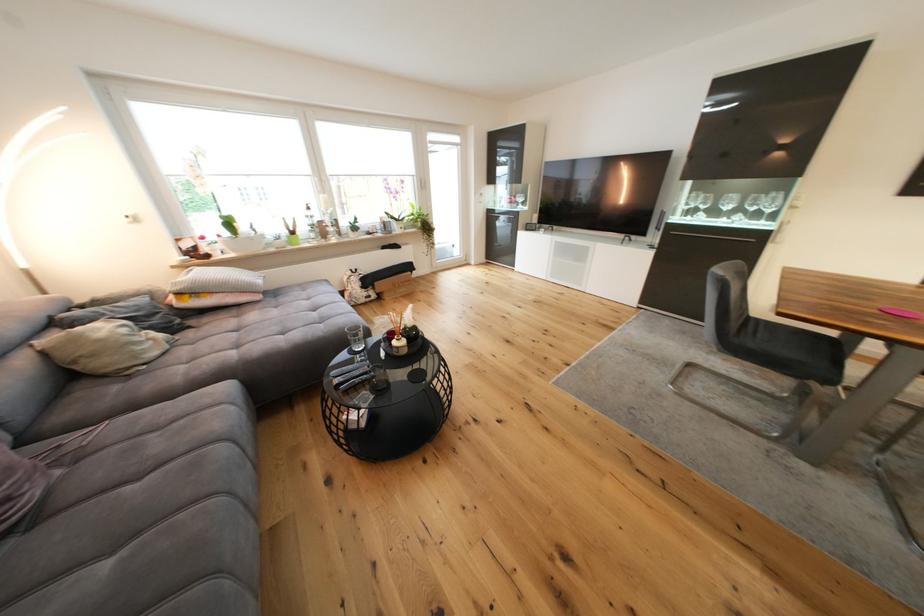
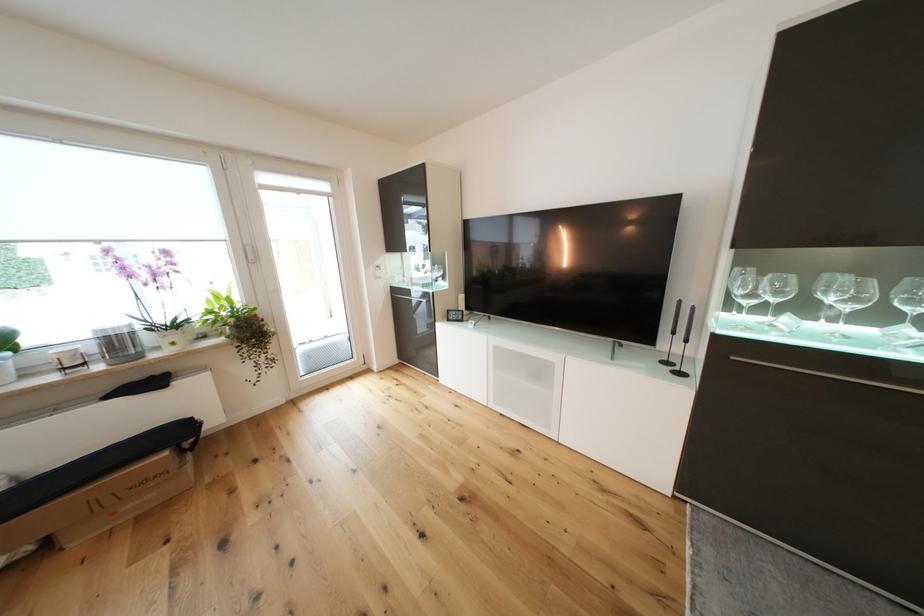
Which direction would the cameraman need to move to produce the second image?

The cameraman walked toward right, forward.